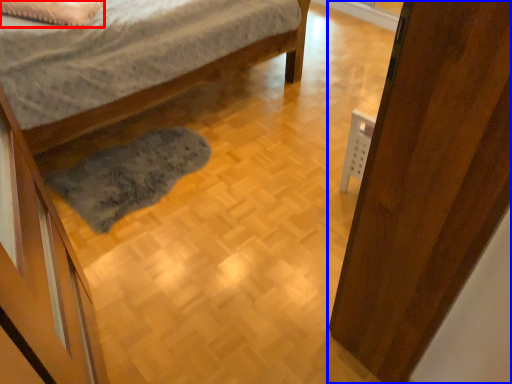
Question: Which point is further to the camera, pillow (highlighted by a red box) or door (highlighted by a blue box)?

Choices:
 (A) pillow
 (B) door

Answer: (A)